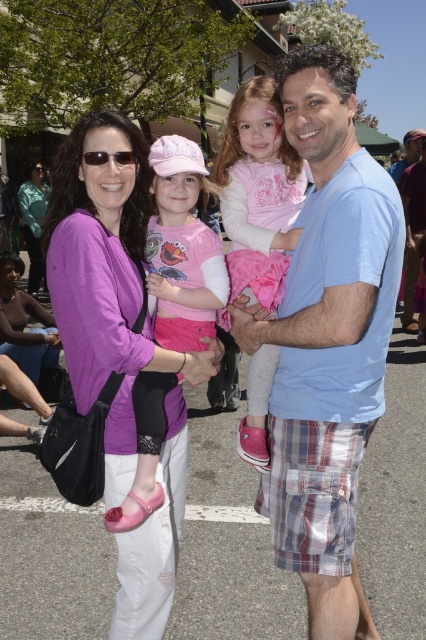
You are a photographer trying to capture a candid shot of the purple soft fabric shirt at upper left and the matte teal jacket at upper left. Which one is more to the right in the frame?

The purple soft fabric shirt at upper left is positioned on the right side of matte teal jacket at upper left, so it is more to the right in the frame.

You are a photographer standing at the camera position. You want to take a closeup shot of the purple soft fabric shirt at upper left. Can you reach it with your 1.8 meter long extendable pole?

The purple soft fabric shirt at upper left is 2.05 meters from camera. The extendable pole is 1.8 meters long, so it is not long enough to reach the shirt. You need a longer pole.

You are trying to decide which jacket to wear for a cold day. The pink fleece jacket at center and the matte teal jacket at upper left are both options. Based on their thickness, which one would be warmer?

The matte teal jacket at upper left is thicker than the pink fleece jacket at center, so it would be warmer for a cold day.